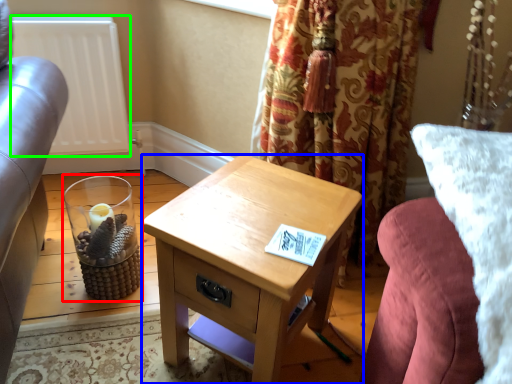
Question: Which is farther away from candle holder (highlighted by a red box)? nightstand (highlighted by a blue box) or radiator (highlighted by a green box)?

Choices:
 (A) nightstand
 (B) radiator

Answer: (A)